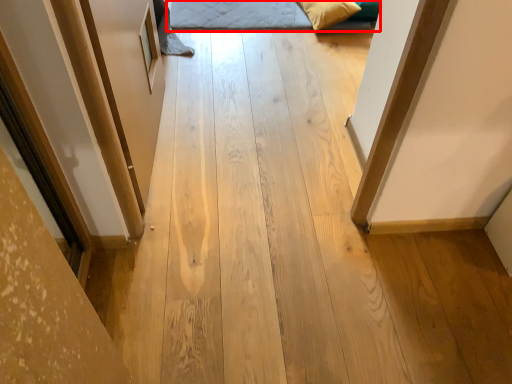
Question: Observing the image, what is the correct spatial positioning of bed (annotated by the red box) in reference to pillow?

Choices:
 (A) right
 (B) left

Answer: (B)